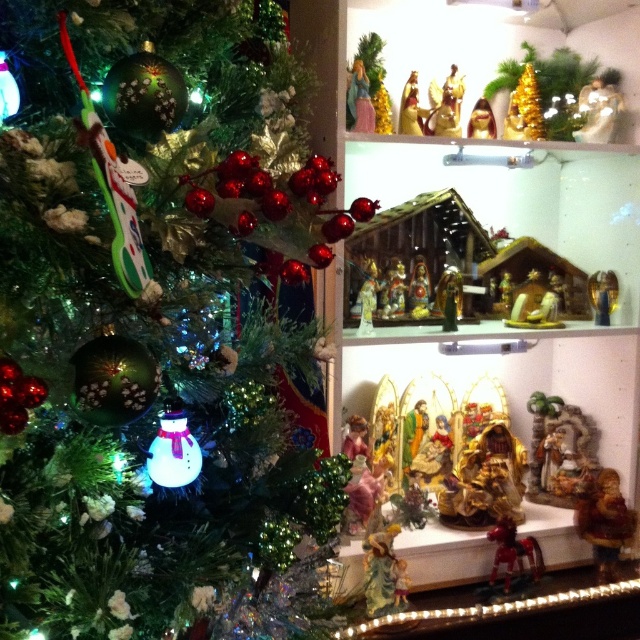
Does gold metallic angel at upper center lie behind gold metallic nativity figure at center?

No, it is in front of gold metallic nativity figure at center.

Image resolution: width=640 pixels, height=640 pixels. I want to click on gold metallic angel at upper center, so click(600, 108).

Which is in front, point (424, 125) or point (417, 314)?

Point (424, 125) is in front.

Is gold metallic nativity set at upper center wider than gold metallic nativity scene at center?

Yes.

Identify the location of gold metallic nativity set at upper center. (445, 106).

Does gold metallic nativity figure at center have a lesser height compared to gold metallic nativity figure at upper center?

Yes.

Who is more distant from viewer, (602, 280) or (410, 118)?

The point (602, 280) is behind.

Is point (604, 308) positioned after point (410, 86)?

Yes, point (604, 308) is behind point (410, 86).

I want to click on gold metallic nativity figure at center, so click(x=602, y=294).